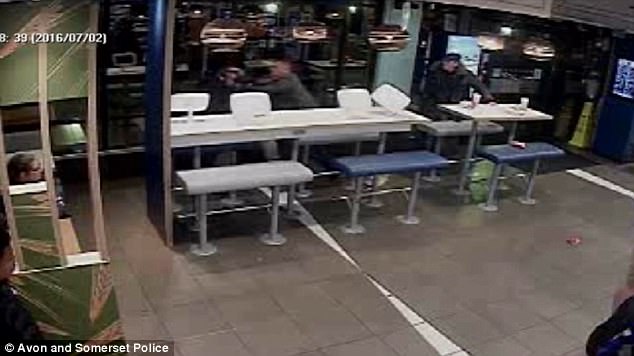
Where is `floor`? floor is located at coordinates (245, 308).